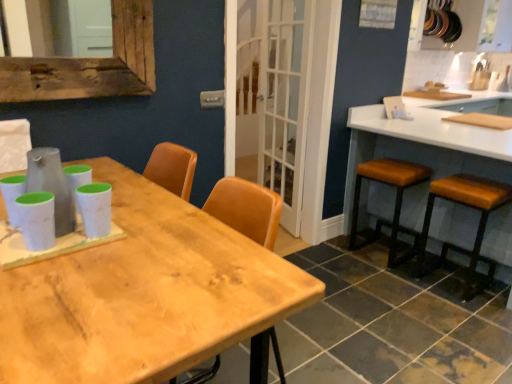
At what (x,y) coordinates should I click in order to perform the action: click on vacant area that lies between brown leather stool at right, which is counted as the 1th stool, starting from the left, and brown leather stool at right, positioned as the 1th stool in right-to-left order. Please return your answer as a coordinate pair (x, y). Looking at the image, I should click on (415, 273).